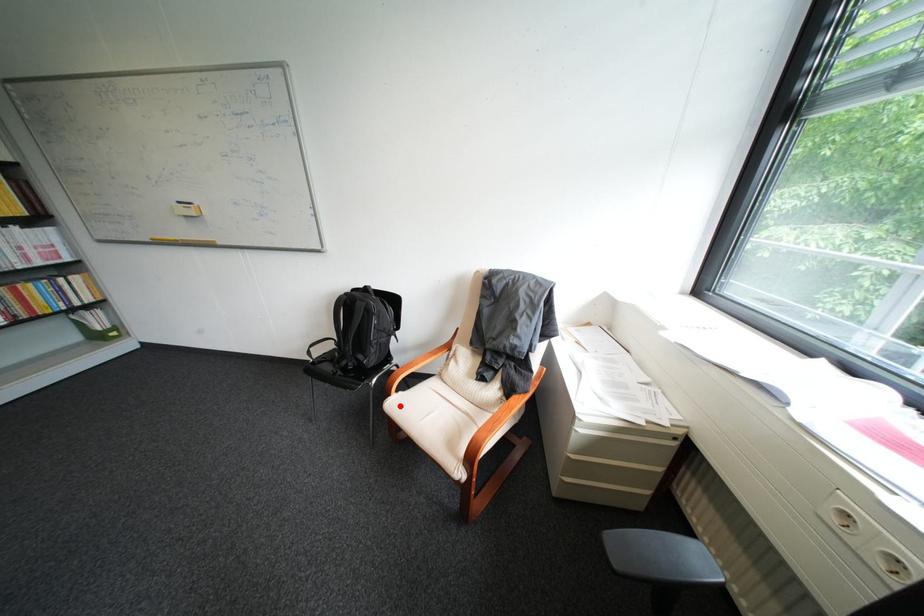
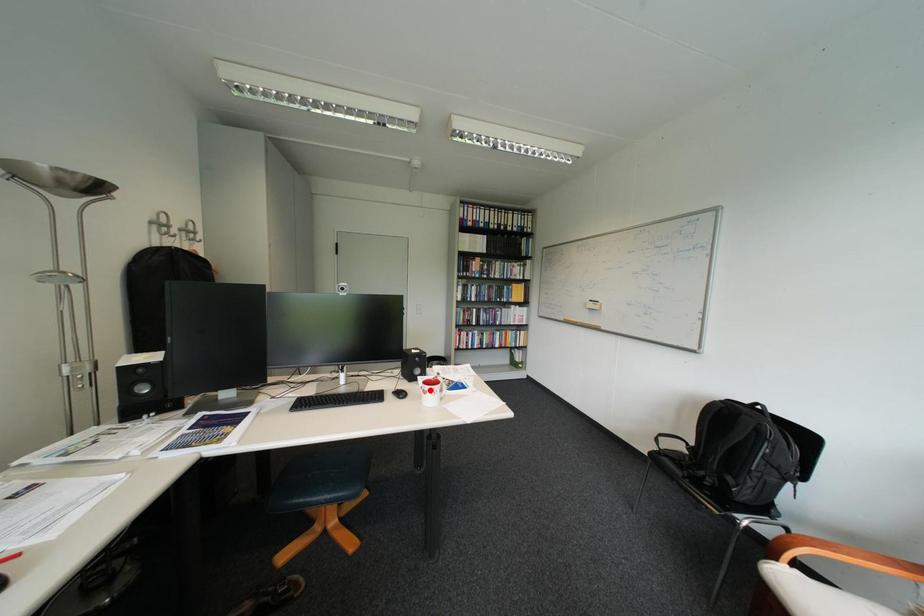
I am providing you with two images of the same scene from different viewpoints. A red point is marked on the first image and another point is marked on the second image. Do the highlighted points in image1 and image2 indicate the same real-world spot?

No